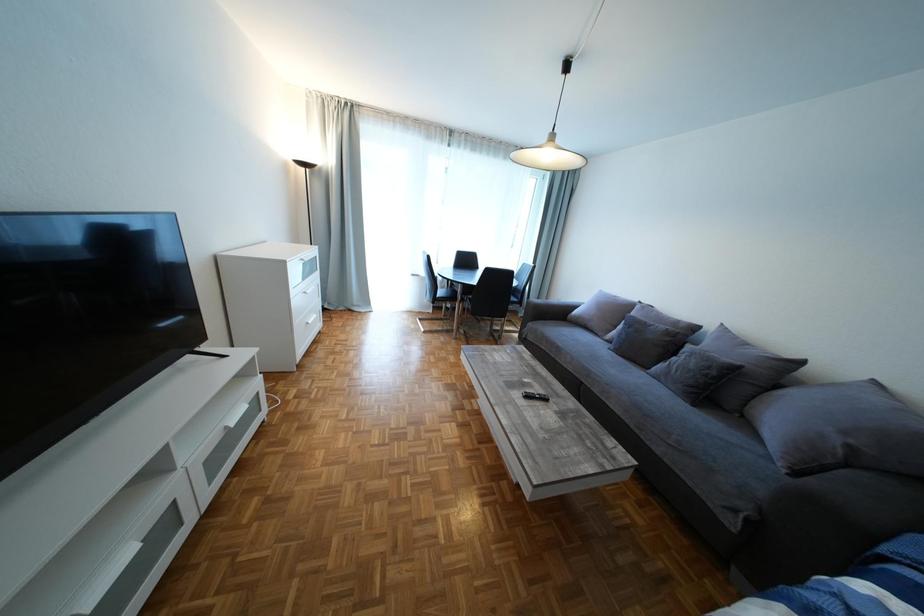
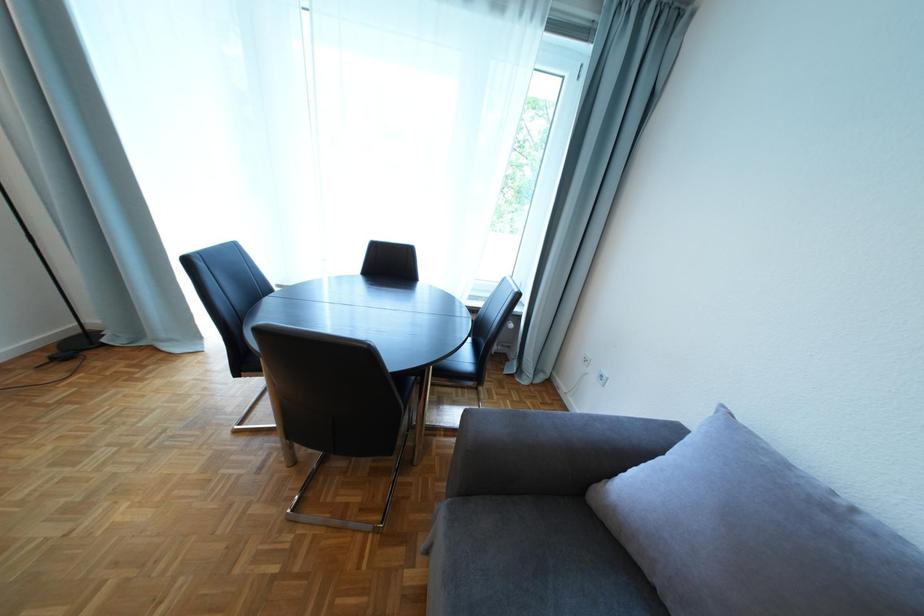
What movement of the cameraman would produce the second image?

The cameraman walked toward right, forward.